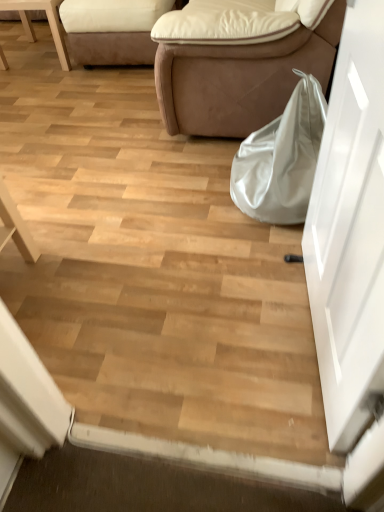
The image size is (384, 512). Describe the element at coordinates (238, 62) in the screenshot. I see `brown leather couch at center, the 2th studio couch positioned from the left` at that location.

Where is `brown leather couch at center, the 2th studio couch positioned from the left`? brown leather couch at center, the 2th studio couch positioned from the left is located at coordinates (238, 62).

Image resolution: width=384 pixels, height=512 pixels. I want to click on white glossy door at right, so [x=350, y=231].

What is the approximate height of white leather chair at upper left?

17.38 inches.

At what (x,y) coordinates should I click in order to perform the action: click on satin white bag at lower right. Please return your answer as a coordinate pair (x, y). The width and height of the screenshot is (384, 512). Looking at the image, I should click on (281, 159).

Is satin white bag at lower right at the back of suede beige studio couch at upper left, the 2th studio couch positioned from the right?

No, suede beige studio couch at upper left, the 2th studio couch positioned from the right, is not facing away from satin white bag at lower right.

Is satin white bag at lower right a part of suede beige studio couch at upper left, the 2th studio couch positioned from the right?

That's incorrect, satin white bag at lower right is not inside suede beige studio couch at upper left, the 2th studio couch positioned from the right.

Does point (73, 11) lie in front of point (264, 132)?

No, (73, 11) is further to viewer.

Identify the location of bag that appears above the suede beige studio couch at upper left, the 2th studio couch positioned from the right (from a real-world perspective). (281, 159).

Does white leather chair at upper left appear on the left side of satin white bag at lower right?

Correct, you'll find white leather chair at upper left to the left of satin white bag at lower right.

Between point (32, 3) and point (315, 156), which one is positioned in front?

The point (315, 156) is more forward.

From the image's perspective, which object appears higher, white leather chair at upper left or satin white bag at lower right?

white leather chair at upper left, from the image's perspective.

This screenshot has width=384, height=512. In order to click on bag that is in front of the white leather chair at upper left in this screenshot , I will do `click(281, 159)`.

Which is more to the left, satin white bag at lower right or white glossy door at right?

satin white bag at lower right is more to the left.

How much distance is there between satin white bag at lower right and white glossy door at right?

satin white bag at lower right is 58.74 centimeters from white glossy door at right.

In the scene shown: Would you say satin white bag at lower right contains white glossy door at right?

Actually, white glossy door at right is outside satin white bag at lower right.

Considering the sizes of objects satin white bag at lower right and white glossy door at right in the image provided, who is taller, satin white bag at lower right or white glossy door at right?

Standing taller between the two is white glossy door at right.

Does satin white bag at lower right have a greater width compared to suede beige studio couch at upper left, the 2th studio couch positioned from the right?

In fact, satin white bag at lower right might be narrower than suede beige studio couch at upper left, the 2th studio couch positioned from the right.

Considering the relative sizes of satin white bag at lower right and suede beige studio couch at upper left, the 2th studio couch positioned from the right, in the image provided, is satin white bag at lower right bigger than suede beige studio couch at upper left, the 2th studio couch positioned from the right,?

No.

Is satin white bag at lower right oriented away from suede beige studio couch at upper left, the 2th studio couch positioned from the right?

No, satin white bag at lower right's orientation is not away from suede beige studio couch at upper left, the 2th studio couch positioned from the right.

From a real-world perspective, is brown leather couch at center, which is the first studio couch in right-to-left order, positioned above or below white leather chair at upper left?

brown leather couch at center, which is the first studio couch in right-to-left order, is above white leather chair at upper left.

Would you say brown leather couch at center, which is the first studio couch in right-to-left order, is outside white leather chair at upper left?

brown leather couch at center, which is the first studio couch in right-to-left order, lies outside white leather chair at upper left's area.

Is brown leather couch at center, the 2th studio couch positioned from the left, positioned with its back to white leather chair at upper left?

brown leather couch at center, the 2th studio couch positioned from the left, does not have its back to white leather chair at upper left.

How many degrees apart are the facing directions of brown leather couch at center, which is the first studio couch in right-to-left order, and white leather chair at upper left?

There is a 91.7-degree angle between the facing directions of brown leather couch at center, which is the first studio couch in right-to-left order, and white leather chair at upper left.

Is white leather chair at upper left not near brown leather couch at center, the 2th studio couch positioned from the left?

Yes, white leather chair at upper left and brown leather couch at center, the 2th studio couch positioned from the left, are located far from each other.

Considering the sizes of objects white leather chair at upper left and brown leather couch at center, the 2th studio couch positioned from the left, in the image provided, who is shorter, white leather chair at upper left or brown leather couch at center, the 2th studio couch positioned from the left,?

white leather chair at upper left.

From the picture: From the image's perspective, which one is positioned lower, white leather chair at upper left or brown leather couch at center, which is the first studio couch in right-to-left order?

brown leather couch at center, which is the first studio couch in right-to-left order, from the image's perspective.

Between white leather chair at upper left and brown leather couch at center, which is the first studio couch in right-to-left order, which one has smaller size?

Smaller between the two is white leather chair at upper left.

Considering the sizes of brown leather couch at center, the 2th studio couch positioned from the left, and white glossy door at right in the image, is brown leather couch at center, the 2th studio couch positioned from the left, taller or shorter than white glossy door at right?

Clearly, brown leather couch at center, the 2th studio couch positioned from the left, is shorter compared to white glossy door at right.

Is brown leather couch at center, which is the first studio couch in right-to-left order, oriented away from white glossy door at right?

That's not correct — brown leather couch at center, which is the first studio couch in right-to-left order, is not looking away from white glossy door at right.

From the image's perspective, who appears lower, brown leather couch at center, the 2th studio couch positioned from the left, or white glossy door at right?

white glossy door at right appears lower in the image.

Looking at this image, is brown leather couch at center, which is the first studio couch in right-to-left order, far from white glossy door at right?

They are positioned close to each other.

The image size is (384, 512). I want to click on bag in front of the suede beige studio couch at upper left, the 2th studio couch positioned from the right, so click(281, 159).

Where is `bag located above the white leather chair at upper left (from a real-world perspective)`? The image size is (384, 512). bag located above the white leather chair at upper left (from a real-world perspective) is located at coordinates (281, 159).

From the image, which object appears to be nearer to satin white bag at lower right, white glossy door at right or white leather chair at upper left?

white glossy door at right is closer to satin white bag at lower right.

From the image, which object appears to be farther from brown leather couch at center, the 2th studio couch positioned from the left, white leather chair at upper left or suede beige studio couch at upper left, the first studio couch in the left-to-right sequence?

white leather chair at upper left lies further to brown leather couch at center, the 2th studio couch positioned from the left, than the other object.

Estimate the real-world distances between objects in this image. Which object is closer to white leather chair at upper left, suede beige studio couch at upper left, the 2th studio couch positioned from the right, or satin white bag at lower right?

suede beige studio couch at upper left, the 2th studio couch positioned from the right, is positioned closer to the anchor white leather chair at upper left.

From the image, which object appears to be nearer to suede beige studio couch at upper left, the first studio couch in the left-to-right sequence, brown leather couch at center, which is the first studio couch in right-to-left order, or white leather chair at upper left?

Among the two, white leather chair at upper left is located nearer to suede beige studio couch at upper left, the first studio couch in the left-to-right sequence.

When comparing their distances from suede beige studio couch at upper left, the 2th studio couch positioned from the right, does brown leather couch at center, which is the first studio couch in right-to-left order, or satin white bag at lower right seem closer?

The object closer to suede beige studio couch at upper left, the 2th studio couch positioned from the right, is brown leather couch at center, which is the first studio couch in right-to-left order.

From the image, which object appears to be nearer to satin white bag at lower right, brown leather couch at center, which is the first studio couch in right-to-left order, or white glossy door at right?

brown leather couch at center, which is the first studio couch in right-to-left order, lies closer to satin white bag at lower right than the other object.

From the image, which object appears to be nearer to satin white bag at lower right, white leather chair at upper left or brown leather couch at center, the 2th studio couch positioned from the left?

brown leather couch at center, the 2th studio couch positioned from the left, is positioned closer to the anchor satin white bag at lower right.

Looking at the image, which one is located closer to white glossy door at right, satin white bag at lower right or suede beige studio couch at upper left, the first studio couch in the left-to-right sequence?

Among the two, satin white bag at lower right is located nearer to white glossy door at right.

This screenshot has width=384, height=512. Identify the location of studio couch between white leather chair at upper left and satin white bag at lower right in the horizontal direction. (112, 30).

At what (x,y) coordinates should I click in order to perform the action: click on studio couch between white glossy door at right and suede beige studio couch at upper left, the first studio couch in the left-to-right sequence, in the front-back direction. Please return your answer as a coordinate pair (x, y). Looking at the image, I should click on (238, 62).

This screenshot has width=384, height=512. I want to click on bag between white leather chair at upper left and brown leather couch at center, which is the first studio couch in right-to-left order, in the horizontal direction, so click(x=281, y=159).

Find the location of a particular element. bag between white glossy door at right and suede beige studio couch at upper left, the first studio couch in the left-to-right sequence, from front to back is located at coordinates (281, 159).